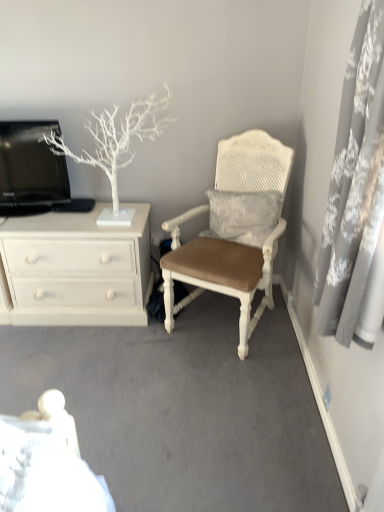
Identify the location of free point above white painted wood chest of drawers at left (from a real-world perspective). tap(73, 214).